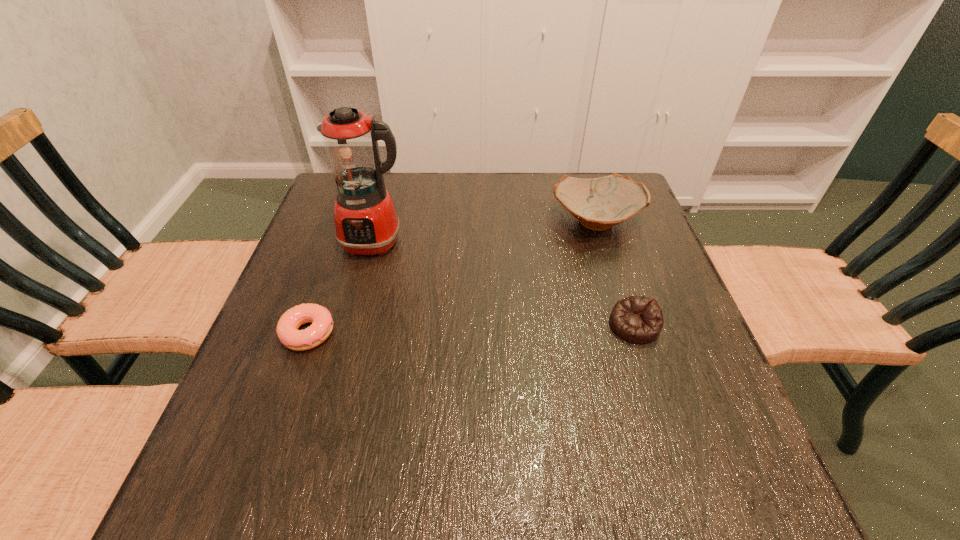
Where is `vacant space that satisfies the following two spatial constraints: 1. on the back side of the doughnut; 2. on the left side of the beanbag`? This screenshot has height=540, width=960. vacant space that satisfies the following two spatial constraints: 1. on the back side of the doughnut; 2. on the left side of the beanbag is located at coordinates (311, 325).

Where is `free location that satisfies the following two spatial constraints: 1. on the front side of the beanbag; 2. on the right side of the second tallest object`? free location that satisfies the following two spatial constraints: 1. on the front side of the beanbag; 2. on the right side of the second tallest object is located at coordinates (628, 325).

The image size is (960, 540). What are the coordinates of `free spot that satisfies the following two spatial constraints: 1. on the controls of the food processor; 2. on the right side of the beanbag` in the screenshot? It's located at (352, 325).

Locate an element on the screen. vacant region that satisfies the following two spatial constraints: 1. on the front side of the third shortest object; 2. on the left side of the beanbag is located at coordinates (628, 325).